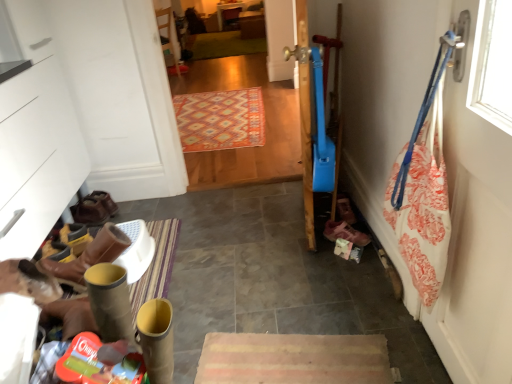
Question: Could you tell me if pink fabric shoe at lower right, the 3th footwear positioned from the back, is turned towards brown leather boots at lower left, marked as the first footwear in a back-to-front arrangement?

Choices:
 (A) yes
 (B) no

Answer: (B)

Question: From a real-world perspective, does pink fabric shoe at lower right, placed as the first footwear when sorted from right to left, sit lower than brown leather boots at lower left, marked as the first footwear in a back-to-front arrangement?

Choices:
 (A) yes
 (B) no

Answer: (A)

Question: Is brown leather boots at lower left, positioned as the second footwear in right-to-left order, surrounded by pink fabric shoe at lower right, which is the 1th footwear in front-to-back order?

Choices:
 (A) no
 (B) yes

Answer: (A)

Question: Can you confirm if pink fabric shoe at lower right, the third footwear in the left-to-right sequence, is shorter than brown leather boots at lower left, positioned as the second footwear in right-to-left order?

Choices:
 (A) yes
 (B) no

Answer: (A)

Question: Is pink fabric shoe at lower right, the 3th footwear positioned from the back, next to brown leather boots at lower left, positioned as the second footwear in right-to-left order?

Choices:
 (A) no
 (B) yes

Answer: (A)

Question: Is brown leather boots at lower left, the 3th footwear when ordered from right to left, to the left or to the right of pink fabric shoe at lower right, the third footwear in the left-to-right sequence, in the image?

Choices:
 (A) left
 (B) right

Answer: (A)

Question: Is brown leather boots at lower left, the 3th footwear when ordered from right to left, in front of or behind pink fabric shoe at lower right, the third footwear in the left-to-right sequence, in the image?

Choices:
 (A) front
 (B) behind

Answer: (B)

Question: Is point (89, 218) closer or farther from the camera than point (347, 228)?

Choices:
 (A) closer
 (B) farther

Answer: (B)

Question: Is brown leather boots at lower left, positioned as the second footwear in back-to-front order, bigger or smaller than pink fabric shoe at lower right, the 3th footwear positioned from the back?

Choices:
 (A) small
 (B) big

Answer: (B)

Question: From the image's perspective, is carpeted wooden floor at center located above or below white fabric at right?

Choices:
 (A) below
 (B) above

Answer: (B)

Question: Choose the correct answer: Is carpeted wooden floor at center inside white fabric at right or outside it?

Choices:
 (A) inside
 (B) outside

Answer: (B)

Question: In terms of width, does carpeted wooden floor at center look wider or thinner when compared to white fabric at right?

Choices:
 (A) wide
 (B) thin

Answer: (A)

Question: Does point (211, 87) appear closer or farther from the camera than point (444, 120)?

Choices:
 (A) farther
 (B) closer

Answer: (A)

Question: Considering their positions, is carpeted wooden floor at center located in front of or behind brown leather boots at lower left, the 1th footwear from the left?

Choices:
 (A) behind
 (B) front

Answer: (B)

Question: Does point 265,56 appear closer or farther from the camera than point 86,213?

Choices:
 (A) farther
 (B) closer

Answer: (A)